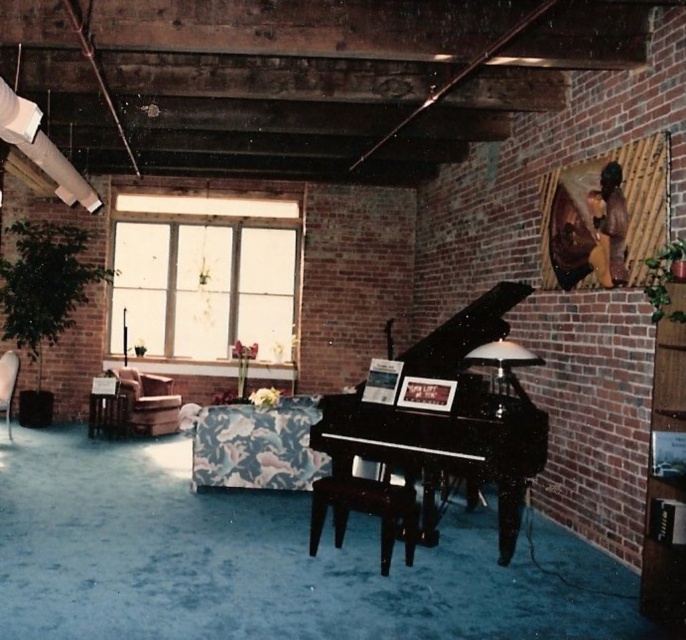
Between black polished piano at center and brown leather armchair at left, which one appears on the right side from the viewer's perspective?

From the viewer's perspective, black polished piano at center appears more on the right side.

Who is more distant from viewer, (x=466, y=486) or (x=165, y=403)?

The point (x=165, y=403) is behind.

Image resolution: width=686 pixels, height=640 pixels. In order to click on black polished piano at center in this screenshot , I will do `click(436, 435)`.

Looking at this image, how far apart are shiny black stool at center and floral fabric armchair at left?

The distance of shiny black stool at center from floral fabric armchair at left is 5.39 meters.

Is shiny black stool at center taller than floral fabric armchair at left?

No, shiny black stool at center is not taller than floral fabric armchair at left.

What do you see at coordinates (366, 513) in the screenshot? I see `shiny black stool at center` at bounding box center [366, 513].

Identify the location of shiny black stool at center. Image resolution: width=686 pixels, height=640 pixels. (366, 513).

Looking at this image, who is taller, brown leather armchair at left or floral fabric armchair at left?

With more height is floral fabric armchair at left.

Is brown leather armchair at left bigger than floral fabric armchair at left?

Indeed, brown leather armchair at left has a larger size compared to floral fabric armchair at left.

This screenshot has height=640, width=686. I want to click on brown leather armchair at left, so click(147, 401).

Identify the location of brown leather armchair at left. (147, 401).